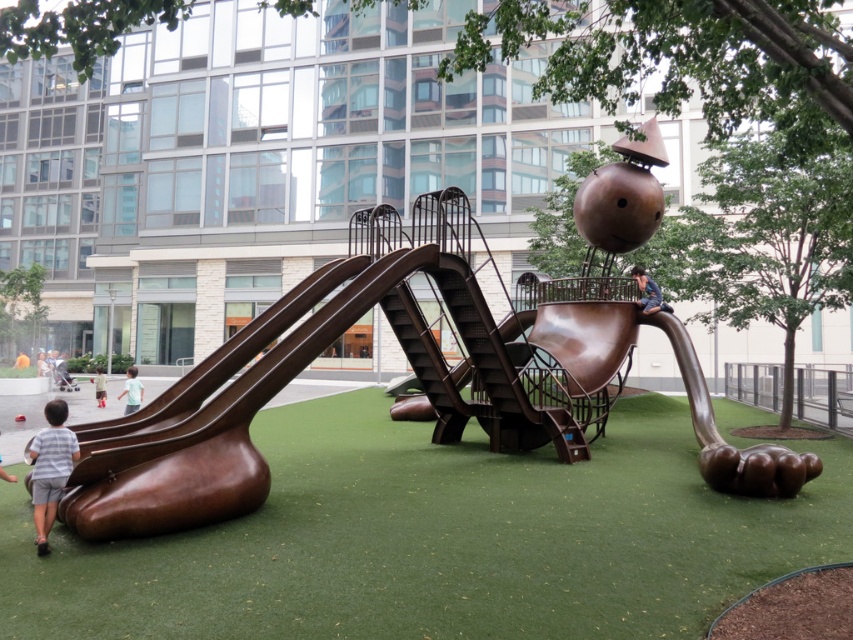
Question: Does green artificial turf at lower center appear over bronze sculpture at center?

Choices:
 (A) no
 (B) yes

Answer: (A)

Question: Among these points, which one is nearest to the camera?

Choices:
 (A) (643, 307)
 (B) (48, 467)

Answer: (B)

Question: Can you confirm if bronze smooth slide at lower left is thinner than bronze statue at center?

Choices:
 (A) no
 (B) yes

Answer: (A)

Question: Which of the following is the farthest from the observer?

Choices:
 (A) (404, 474)
 (B) (103, 392)
 (C) (268, 317)

Answer: (B)

Question: Considering the real-world distances, which object is farthest from the light blue shirt at lower left?

Choices:
 (A) brown fabric shorts at lower left
 (B) green artificial turf at lower center

Answer: (B)

Question: Can you confirm if striped cotton shirt at lower left is bigger than brown fabric shorts at lower left?

Choices:
 (A) yes
 (B) no

Answer: (B)